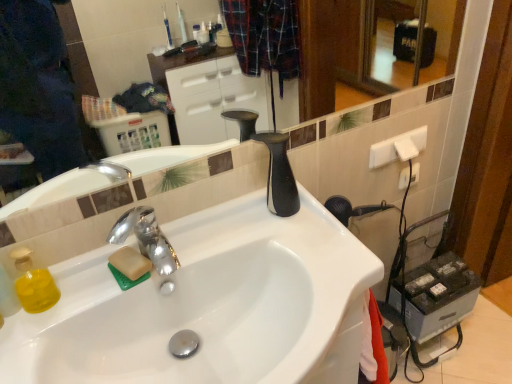
Question: Does chrome metallic faucet at center lie in front of white plastic electric outlet at upper right?

Choices:
 (A) no
 (B) yes

Answer: (B)

Question: Is chrome metallic faucet at center wider than white plastic electric outlet at upper right?

Choices:
 (A) no
 (B) yes

Answer: (B)

Question: Considering the relative sizes of chrome metallic faucet at center and white plastic electric outlet at upper right in the image provided, is chrome metallic faucet at center taller than white plastic electric outlet at upper right?

Choices:
 (A) no
 (B) yes

Answer: (B)

Question: Is chrome metallic faucet at center bigger than white plastic electric outlet at upper right?

Choices:
 (A) no
 (B) yes

Answer: (B)

Question: Is chrome metallic faucet at center to the left of white plastic electric outlet at upper right from the viewer's perspective?

Choices:
 (A) yes
 (B) no

Answer: (A)

Question: From a real-world perspective, is white plastic electric outlet at upper right positioned above or below chrome metallic faucet at center?

Choices:
 (A) above
 (B) below

Answer: (B)

Question: Is point (402, 170) positioned closer to the camera than point (117, 228)?

Choices:
 (A) farther
 (B) closer

Answer: (A)

Question: Visually, is white plastic electric outlet at upper right positioned to the left or to the right of chrome metallic faucet at center?

Choices:
 (A) right
 (B) left

Answer: (A)

Question: From the image's perspective, relative to chrome metallic faucet at center, is white plastic electric outlet at upper right above or below?

Choices:
 (A) above
 (B) below

Answer: (A)

Question: From a real-world perspective, is chrome metallic faucet at center above or below glossy ceramic mirror at upper center?

Choices:
 (A) above
 (B) below

Answer: (B)

Question: In the image, is chrome metallic faucet at center on the left side or the right side of glossy ceramic mirror at upper center?

Choices:
 (A) left
 (B) right

Answer: (A)

Question: From the image's perspective, is chrome metallic faucet at center above or below glossy ceramic mirror at upper center?

Choices:
 (A) below
 (B) above

Answer: (A)

Question: Considering the positions of chrome metallic faucet at center and glossy ceramic mirror at upper center in the image, is chrome metallic faucet at center taller or shorter than glossy ceramic mirror at upper center?

Choices:
 (A) short
 (B) tall

Answer: (A)

Question: Does point (372, 112) appear closer or farther from the camera than point (397, 185)?

Choices:
 (A) closer
 (B) farther

Answer: (A)

Question: In terms of size, does glossy ceramic mirror at upper center appear bigger or smaller than white plastic electric outlet at upper right?

Choices:
 (A) small
 (B) big

Answer: (B)